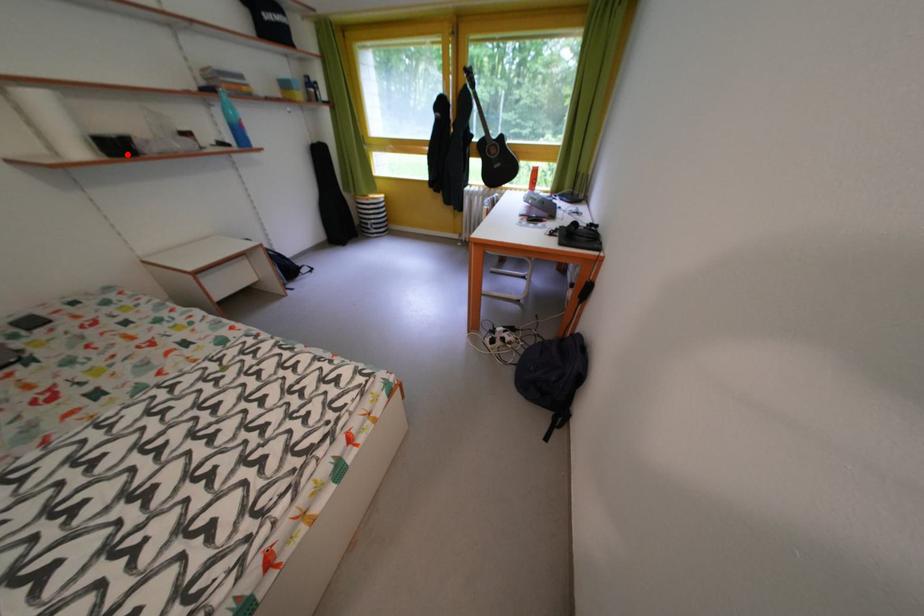
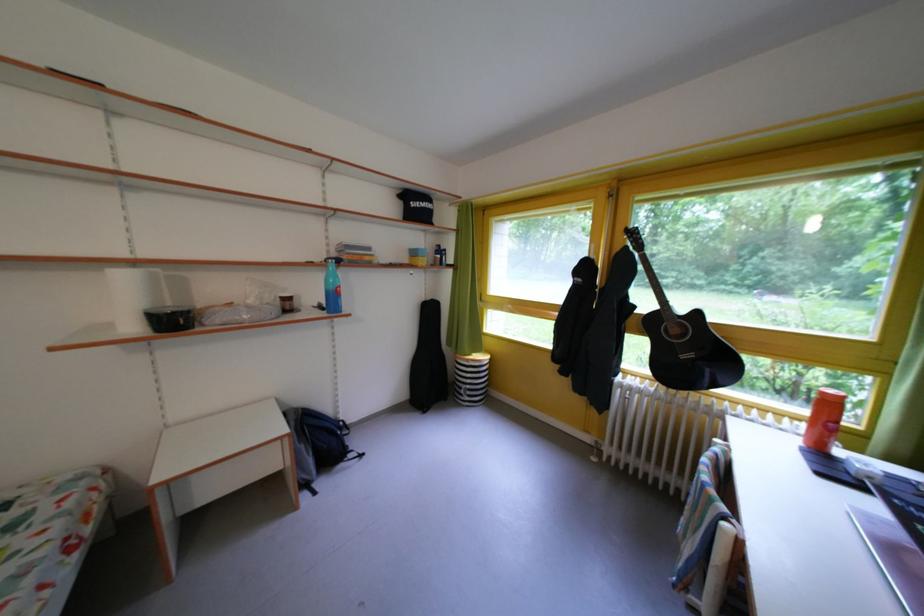
Question: I am providing you with two images of the same scene from different viewpoints. A red point is shown in image1. For the corresponding object point in image2, is it positioned nearer or farther from the camera?

Choices:
 (A) Nearer
 (B) Farther

Answer: (A)